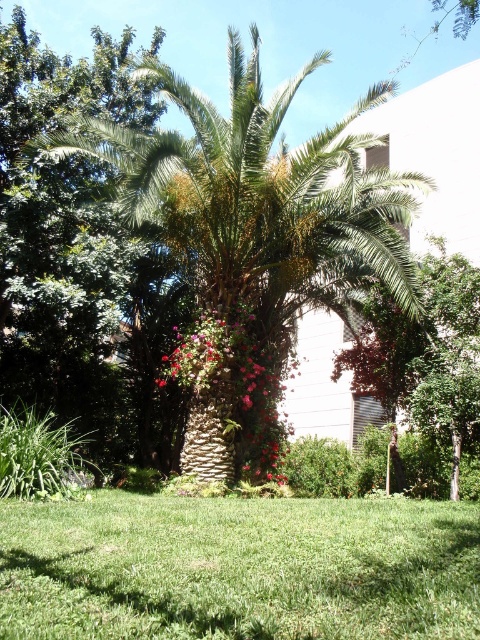
Can you confirm if green leafy tree at center is wider than pink textured flowers at center?

Incorrect, green leafy tree at center's width does not surpass pink textured flowers at center's.

Which is below, green leafy tree at center or pink textured flowers at center?

Positioned lower is pink textured flowers at center.

The height and width of the screenshot is (640, 480). Find the location of `green leafy tree at center`. green leafy tree at center is located at coordinates (424, 353).

Between green grass at center and pink textured flowers at center, which one is positioned higher?

pink textured flowers at center

Is green grass at center further to camera compared to pink textured flowers at center?

No, it is in front of pink textured flowers at center.

Where is `green grass at center`? green grass at center is located at coordinates (239, 566).

Who is more forward, (383, 573) or (407, 317)?

Point (383, 573) is more forward.

Is point (467, 564) positioned after point (389, 310)?

No.

Based on the photo, measure the distance between green grass at center and camera.

green grass at center and camera are 4.99 meters apart.

The width and height of the screenshot is (480, 640). Identify the location of green grass at center. (239, 566).